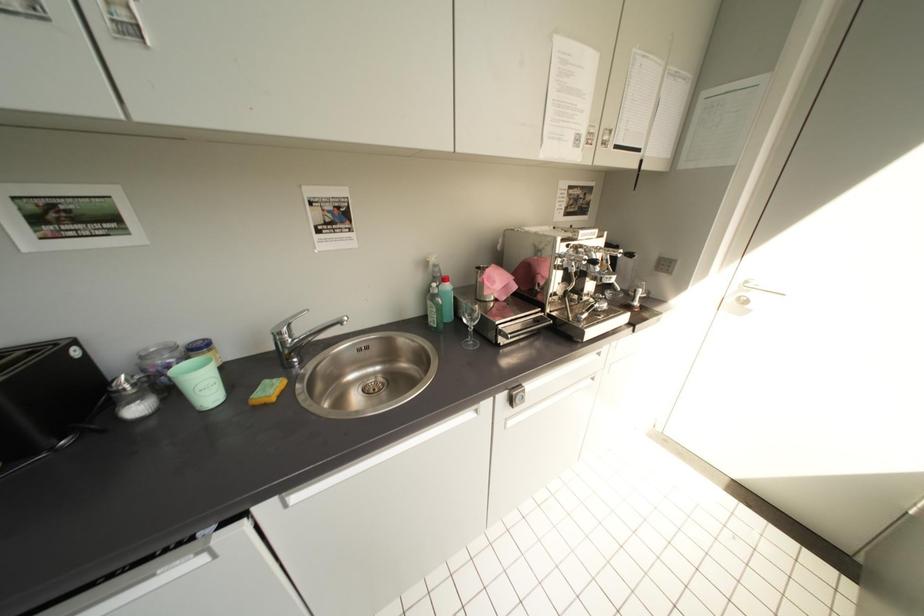
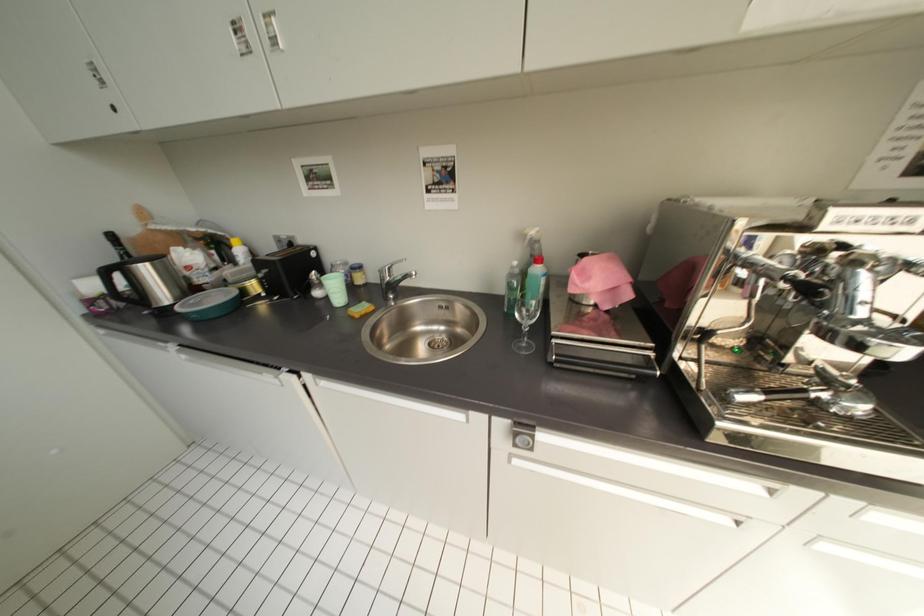
Question: The first image is from the beginning of the video and the second image is from the end. How did the camera likely rotate when shooting the video?

Choices:
 (A) Left
 (B) Right
 (C) Up
 (D) Down

Answer: (A)